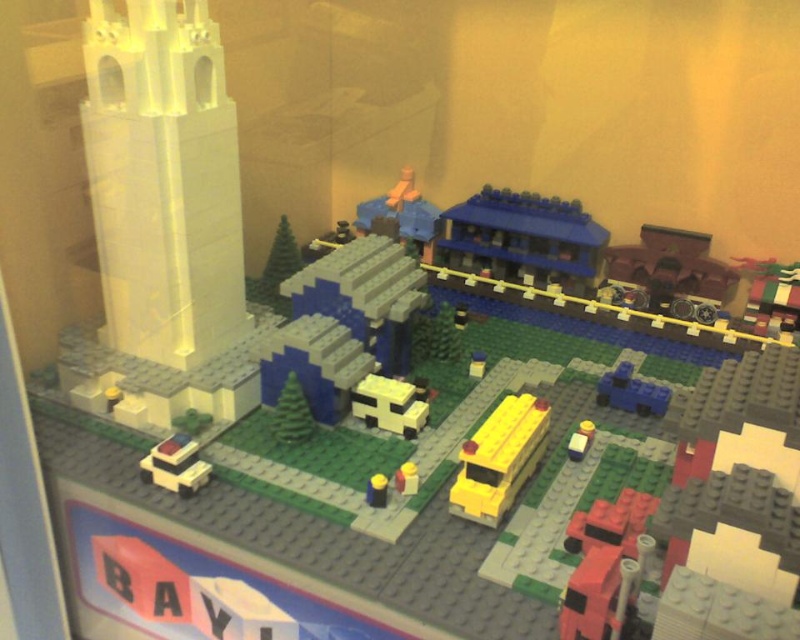
From the picture: You are a LEGO figure standing at the base of the tall white LEGO tower on the left. You want to reach the metallic silver car at center right. Which direction should you walk to get there?

You should walk towards the center right from the tall white LEGO tower on the left to reach the metallic silver car at center right.

You are a LEGO figure standing on the yellow matte bench at center. You want to get into the metallic silver car at center right. Is there a clear path for you to walk to the car?

The metallic silver car at center right is positioned over the yellow matte bench at center, so there is no clear path for the LEGO figure to walk to the car.